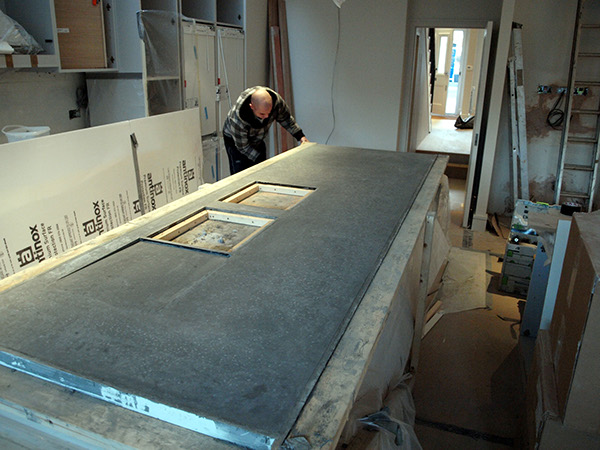
At what (x,y) coordinates should I click in order to perform the action: click on doors. Please return your answer as a coordinate pair (x, y). Looking at the image, I should click on (236, 349), (499, 98), (449, 44).